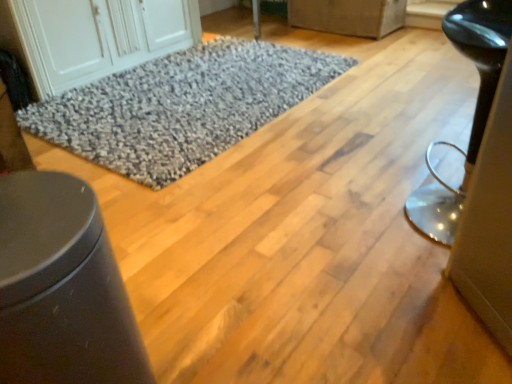
Question: Is matte gray fabric couch at upper center, placed as the 3th furniture when sorted from bottom to top, positioned beyond the bounds of glossy black stool at right, which appears as the 2th furniture when viewed from the back?

Choices:
 (A) no
 (B) yes

Answer: (B)

Question: Considering the relative sizes of matte gray fabric couch at upper center, marked as the 1th furniture in a right-to-left arrangement, and glossy black stool at right, which is counted as the second furniture, starting from the left, in the image provided, is matte gray fabric couch at upper center, marked as the 1th furniture in a right-to-left arrangement, bigger than glossy black stool at right, which is counted as the second furniture, starting from the left,?

Choices:
 (A) no
 (B) yes

Answer: (A)

Question: Does matte gray fabric couch at upper center, the third furniture in the left-to-right sequence, lie in front of glossy black stool at right, the 2th furniture from the bottom?

Choices:
 (A) yes
 (B) no

Answer: (B)

Question: Is glossy black stool at right, acting as the 2th furniture starting from the right, inside matte gray fabric couch at upper center, the third furniture in the left-to-right sequence?

Choices:
 (A) yes
 (B) no

Answer: (B)

Question: Is glossy black stool at right, which is the second furniture from front to back, at the back of matte gray fabric couch at upper center, which ranks as the third furniture in front-to-back order?

Choices:
 (A) no
 (B) yes

Answer: (A)

Question: From the image's perspective, is matte gray fabric couch at upper center, the third furniture in the left-to-right sequence, located beneath glossy black stool at right, which is the second furniture from front to back?

Choices:
 (A) no
 (B) yes

Answer: (A)

Question: Does white wood cabinet at upper left have a smaller size compared to matte black trash can at lower left, which is the first furniture in front-to-back order?

Choices:
 (A) yes
 (B) no

Answer: (B)

Question: Is white wood cabinet at upper left wider than matte black trash can at lower left, which is the 1th furniture from bottom to top?

Choices:
 (A) yes
 (B) no

Answer: (A)

Question: From a real-world perspective, is white wood cabinet at upper left physically above matte black trash can at lower left, which is the first furniture in front-to-back order?

Choices:
 (A) yes
 (B) no

Answer: (B)

Question: From the image's perspective, is white wood cabinet at upper left below matte black trash can at lower left, the third furniture in the top-to-bottom sequence?

Choices:
 (A) yes
 (B) no

Answer: (B)

Question: Is white wood cabinet at upper left oriented away from matte black trash can at lower left, which is the first furniture in front-to-back order?

Choices:
 (A) no
 (B) yes

Answer: (A)

Question: From a real-world perspective, is white wood cabinet at upper left located beneath matte black trash can at lower left, which is the first furniture in front-to-back order?

Choices:
 (A) yes
 (B) no

Answer: (A)

Question: From the image's perspective, is white wood cabinet at upper left over gray shaggy rug at center?

Choices:
 (A) no
 (B) yes

Answer: (B)